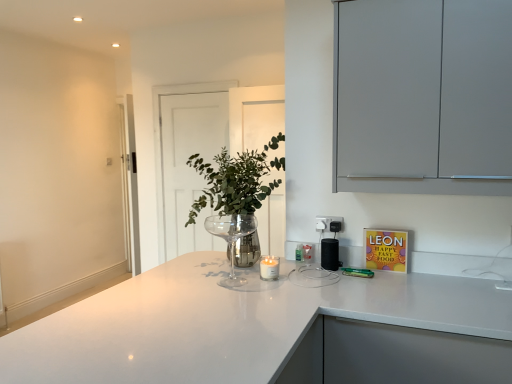
Measure the distance between point (324, 265) and camera.

A distance of 2.17 meters exists between point (324, 265) and camera.

Measure the distance between transparent glass door at center and camera.

transparent glass door at center and camera are 3.33 meters apart.

This screenshot has width=512, height=384. What do you see at coordinates (231, 239) in the screenshot?
I see `clear glass wine glass at center` at bounding box center [231, 239].

Identify the location of clear glass wine glass at center. The image size is (512, 384). (231, 239).

Describe the element at coordinates (328, 222) in the screenshot. I see `black plastic electric outlet at upper right` at that location.

The width and height of the screenshot is (512, 384). Describe the element at coordinates (423, 96) in the screenshot. I see `matte gray cabinet at upper right` at that location.

Locate an element on the screen. matte gray cabinet at upper right is located at coordinates (423, 96).

This screenshot has height=384, width=512. I want to click on black plastic speaker at center, so click(x=330, y=254).

From the picture: From a real-world perspective, between black plastic electric outlet at upper right and green leafy plant at center, who is vertically lower?

From a 3D spatial view, black plastic electric outlet at upper right is below.

How different are the orientations of black plastic electric outlet at upper right and green leafy plant at center in degrees?

There is a 88.3-degree angle between the facing directions of black plastic electric outlet at upper right and green leafy plant at center.

Considering the sizes of objects black plastic electric outlet at upper right and green leafy plant at center in the image provided, who is wider, black plastic electric outlet at upper right or green leafy plant at center?

With larger width is green leafy plant at center.

Between black plastic electric outlet at upper right and green leafy plant at center, which one is positioned behind?

black plastic electric outlet at upper right.

From a real-world perspective, between black plastic speaker at center and green leafy plant at center, who is vertically higher?

green leafy plant at center is physically above.

Considering the sizes of black plastic speaker at center and green leafy plant at center in the image, is black plastic speaker at center wider or thinner than green leafy plant at center?

Clearly, black plastic speaker at center has less width compared to green leafy plant at center.

Can you confirm if black plastic speaker at center is taller than green leafy plant at center?

In fact, black plastic speaker at center may be shorter than green leafy plant at center.

Between point (325, 252) and point (220, 165), which one is positioned behind?

The point (220, 165) is farther.

Is matte gray cabinet at upper right not close to green leafy plant at center?

No, there isn't a large distance between matte gray cabinet at upper right and green leafy plant at center.

Is point (397, 144) closer or farther from the camera than point (234, 204)?

Point (397, 144) is closer to the camera than point (234, 204).

Considering the sizes of matte gray cabinet at upper right and green leafy plant at center in the image, is matte gray cabinet at upper right bigger or smaller than green leafy plant at center?

In the image, matte gray cabinet at upper right appears to be smaller than green leafy plant at center.

Considering the relative positions of matte gray cabinet at upper right and green leafy plant at center in the image provided, is matte gray cabinet at upper right to the left or to the right of green leafy plant at center?

In the image, matte gray cabinet at upper right appears on the right side of green leafy plant at center.

In the image, is clear glass wine glass at center positioned in front of or behind white glossy countertop at center?

clear glass wine glass at center is positioned farther from the viewer than white glossy countertop at center.

Could you tell me if clear glass wine glass at center is facing white glossy countertop at center?

No, clear glass wine glass at center is not aimed at white glossy countertop at center.

From a real-world perspective, is clear glass wine glass at center physically located above or below white glossy countertop at center?

clear glass wine glass at center is situated higher than white glossy countertop at center in the real world.

Would you say clear glass wine glass at center is inside or outside white glossy countertop at center?

clear glass wine glass at center is located inside white glossy countertop at center.

From the image's perspective, does transparent glass door at center appear higher than black plastic electric outlet at upper right?

Yes, from the image's perspective, transparent glass door at center is above black plastic electric outlet at upper right.

Which of these two, transparent glass door at center or black plastic electric outlet at upper right, stands taller?

transparent glass door at center.

At what (x,y) coordinates should I click in order to perform the action: click on electric outlet below the transparent glass door at center (from the image's perspective). Please return your answer as a coordinate pair (x, y). This screenshot has height=384, width=512. Looking at the image, I should click on [328, 222].

Can you tell me how much transparent glass door at center and black plastic electric outlet at upper right differ in facing direction?

0.464 degrees.

Who is more distant, matte gray cabinet at upper right or black plastic electric outlet at upper right?

black plastic electric outlet at upper right is behind.

Does point (353, 184) appear closer or farther from the camera than point (320, 218)?

Point (353, 184) is positioned closer to the camera compared to point (320, 218).

Who is smaller, matte gray cabinet at upper right or black plastic electric outlet at upper right?

With smaller size is black plastic electric outlet at upper right.

You are a GUI agent. You are given a task and a screenshot of the screen. Output one action in this format:
    pyautogui.click(x=<x>, y=<y>)
    Task: Click on the cabinetry located on the right of black plastic electric outlet at upper right
    The width and height of the screenshot is (512, 384).
    Given the screenshot: What is the action you would take?
    pyautogui.click(x=423, y=96)

From the image's perspective, between matte gray cabinet at upper right and transparent glass door at center, which one is located above?

From the image's view, matte gray cabinet at upper right is above.

Between matte gray cabinet at upper right and transparent glass door at center, which one has less height?

Standing shorter between the two is matte gray cabinet at upper right.

Could you tell me if matte gray cabinet at upper right is facing transparent glass door at center?

No, matte gray cabinet at upper right is not turned towards transparent glass door at center.

Could transparent glass door at center be considered to be inside matte gray cabinet at upper right?

No, transparent glass door at center is not a part of matte gray cabinet at upper right.

Identify the location of electric outlet below the green leafy plant at center (from a real-world perspective). (328, 222).

Find the location of a particular element. The width and height of the screenshot is (512, 384). appliance behind the green leafy plant at center is located at coordinates (330, 254).

When comparing their distances from green leafy plant at center, does white glossy countertop at center or transparent glass door at center seem closer?

Based on the image, white glossy countertop at center appears to be nearer to green leafy plant at center.

From the image, which object appears to be farther from clear glass wine glass at center, transparent glass door at center or green leafy plant at center?

transparent glass door at center is positioned further to the anchor clear glass wine glass at center.

Considering their positions, is clear glass wine glass at center positioned further to transparent glass door at center than green leafy plant at center?

Based on the image, clear glass wine glass at center appears to be further to transparent glass door at center.

Looking at the image, which one is located closer to black plastic electric outlet at upper right, matte gray cabinet at upper right or clear glass wine glass at center?

clear glass wine glass at center.

Considering their positions, is green leafy plant at center positioned further to white glossy countertop at center than transparent glass door at center?

transparent glass door at center is positioned further to the anchor white glossy countertop at center.

Which object lies nearer to the anchor point black plastic speaker at center, transparent glass door at center or clear glass wine glass at center?

clear glass wine glass at center is closer to black plastic speaker at center.

Looking at the image, which one is located closer to black plastic electric outlet at upper right, transparent glass door at center or black plastic speaker at center?

Based on the image, black plastic speaker at center appears to be nearer to black plastic electric outlet at upper right.

Looking at this image, estimate the real-world distances between objects in this image. Which object is closer to transparent glass door at center, green leafy plant at center or white glossy countertop at center?

green leafy plant at center is positioned closer to the anchor transparent glass door at center.

Identify the location of wine glass between white glossy countertop at center and black plastic electric outlet at upper right in the front-back direction. This screenshot has width=512, height=384. (231, 239).

At what (x,y) coordinates should I click in order to perform the action: click on appliance positioned between green leafy plant at center and transparent glass door at center from near to far. Please return your answer as a coordinate pair (x, y). This screenshot has width=512, height=384. Looking at the image, I should click on (330, 254).

Locate an element on the screen. The height and width of the screenshot is (384, 512). appliance that lies between matte gray cabinet at upper right and white glossy countertop at center from top to bottom is located at coordinates (330, 254).

The width and height of the screenshot is (512, 384). In order to click on appliance situated between green leafy plant at center and black plastic electric outlet at upper right from left to right in this screenshot , I will do `click(330, 254)`.